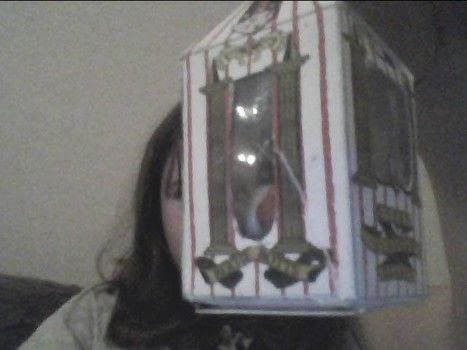
Locate an element on the screen. The height and width of the screenshot is (350, 467). dark grey wall is located at coordinates (435, 31).